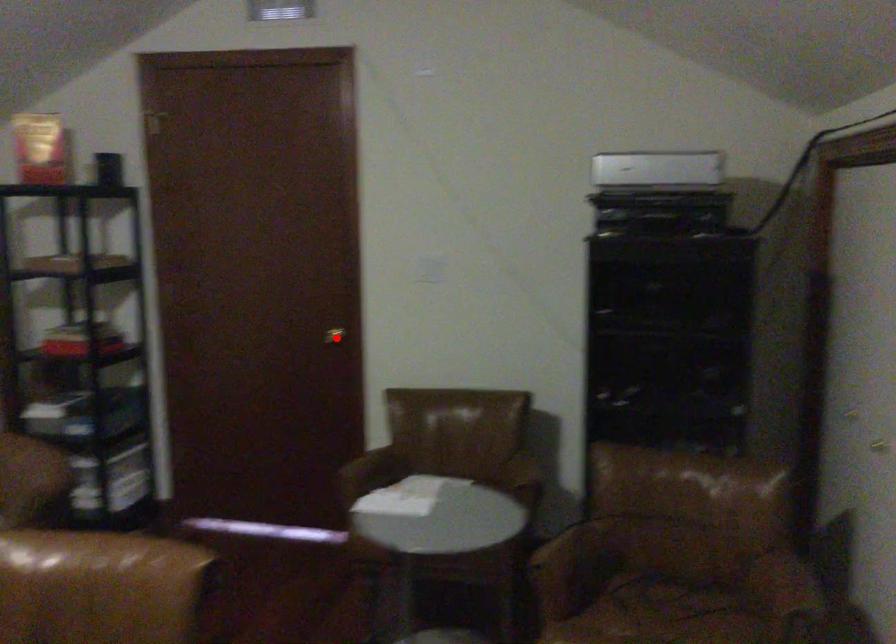
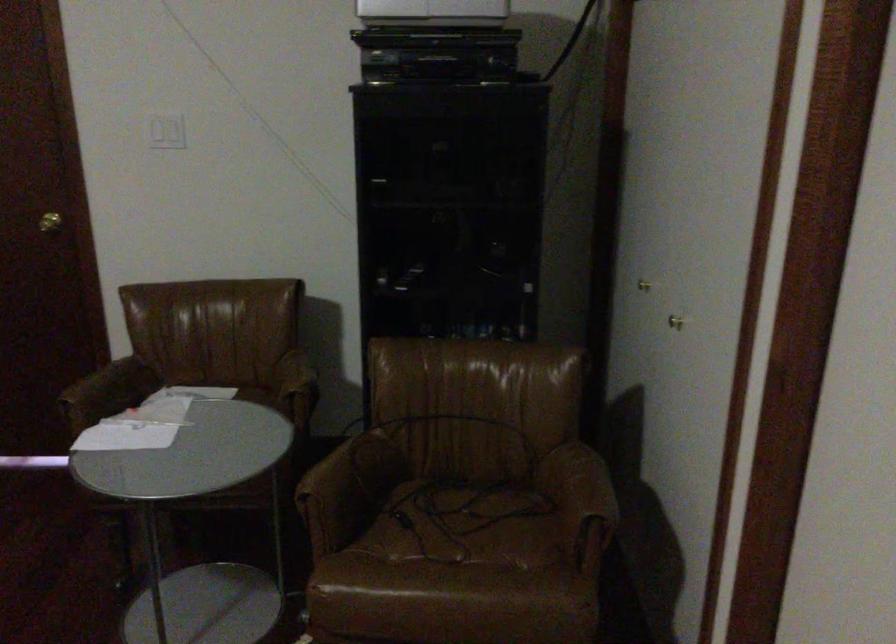
Locate, in the second image, the point that corresponds to the highlighted location in the first image.

(49, 222)